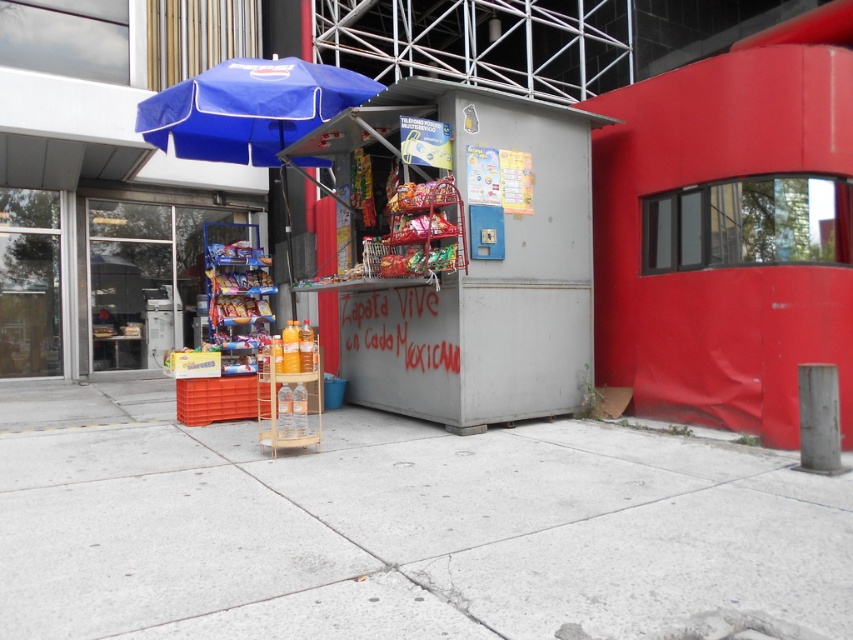
Question: Can you confirm if concrete at center is wider than metallic gray kiosk at center?

Choices:
 (A) no
 (B) yes

Answer: (B)

Question: Which point is farther to the camera?

Choices:
 (A) (241, 84)
 (B) (564, 138)

Answer: (B)

Question: Which of the following is the closest to the observer?

Choices:
 (A) (527, 109)
 (B) (252, 141)
 (C) (73, 577)

Answer: (C)

Question: Is concrete at center positioned at the back of blue fabric umbrella at upper left?

Choices:
 (A) yes
 (B) no

Answer: (B)

Question: Where is concrete at center located in relation to blue fabric umbrella at upper left in the image?

Choices:
 (A) above
 (B) below

Answer: (B)

Question: Which point is farther from the camera taking this photo?

Choices:
 (A) (299, 472)
 (B) (218, 80)
 (C) (396, 116)

Answer: (C)